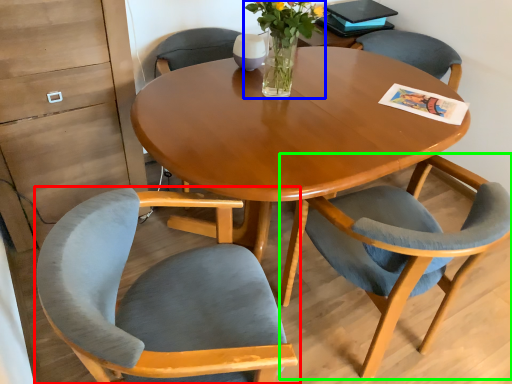
Question: Which is nearer to the chair (highlighted by a red box)? floral arrangement (highlighted by a blue box) or chair (highlighted by a green box).

Choices:
 (A) floral arrangement
 (B) chair

Answer: (B)